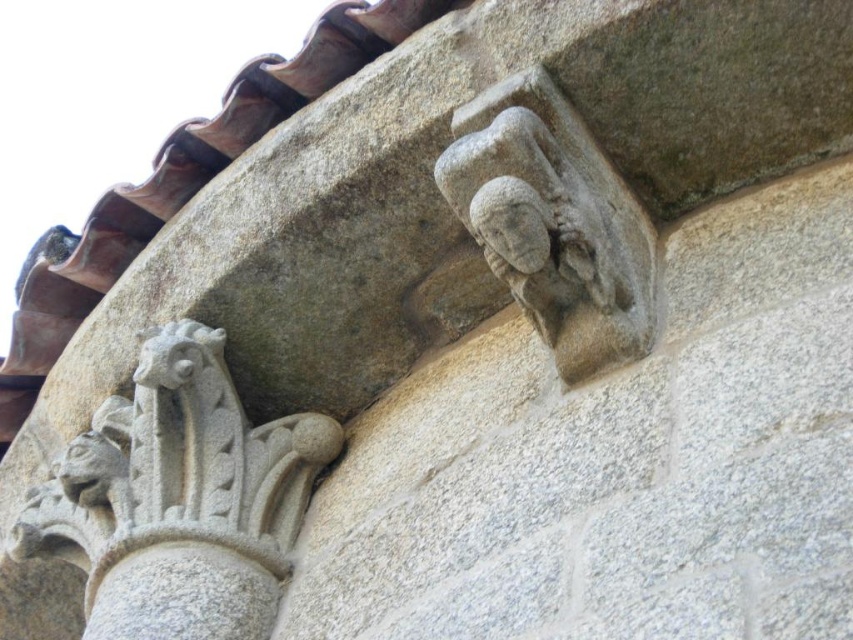
In the scene shown: Is gray stone sculpture at lower left to the right of gray stone head at upper right from the viewer's perspective?

Incorrect, gray stone sculpture at lower left is not on the right side of gray stone head at upper right.

Who is more forward, [80,497] or [602,344]?

Positioned in front is point [602,344].

Where is `gray stone sculpture at lower left`? gray stone sculpture at lower left is located at coordinates (178, 499).